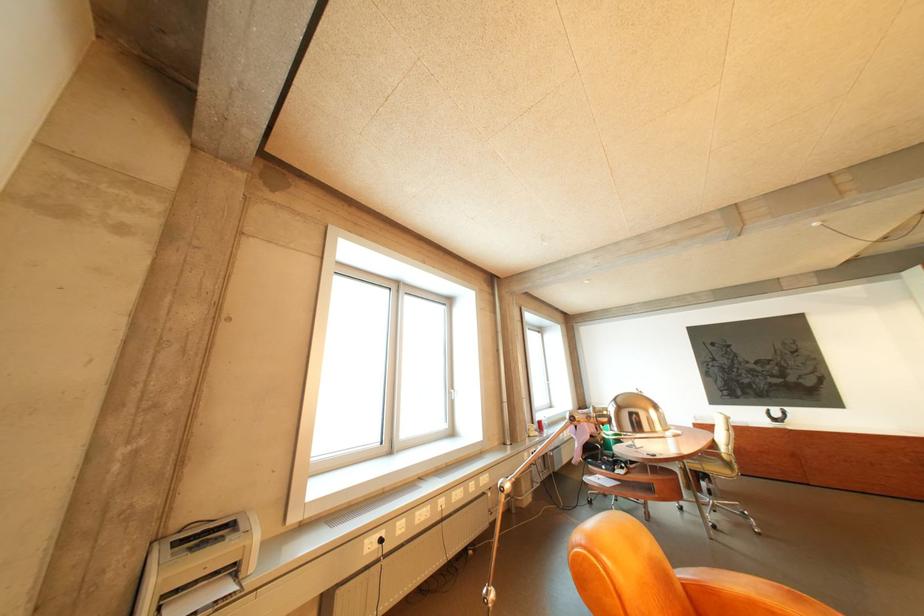
What do you see at coordinates (454, 394) in the screenshot? Image resolution: width=924 pixels, height=616 pixels. I see `the white window handle` at bounding box center [454, 394].